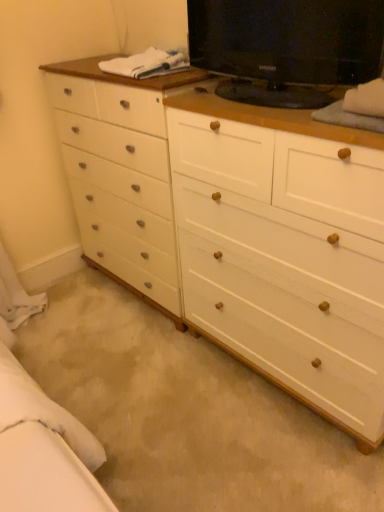
Identify the location of black glossy tv at upper right. This screenshot has height=512, width=384. (286, 47).

Image resolution: width=384 pixels, height=512 pixels. Describe the element at coordinates (286, 47) in the screenshot. I see `black glossy tv at upper right` at that location.

Locate an element on the screen. The image size is (384, 512). black glossy tv at upper right is located at coordinates (286, 47).